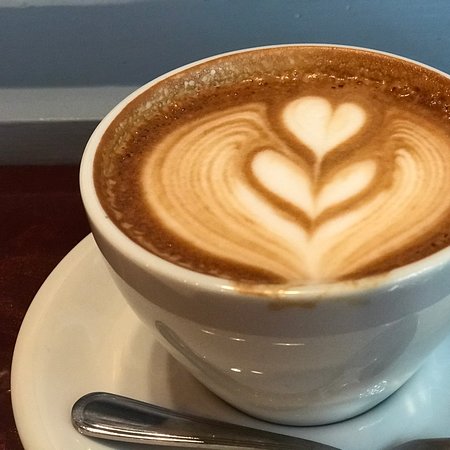
The height and width of the screenshot is (450, 450). Find the location of `silver spoon`. silver spoon is located at coordinates (190, 429).